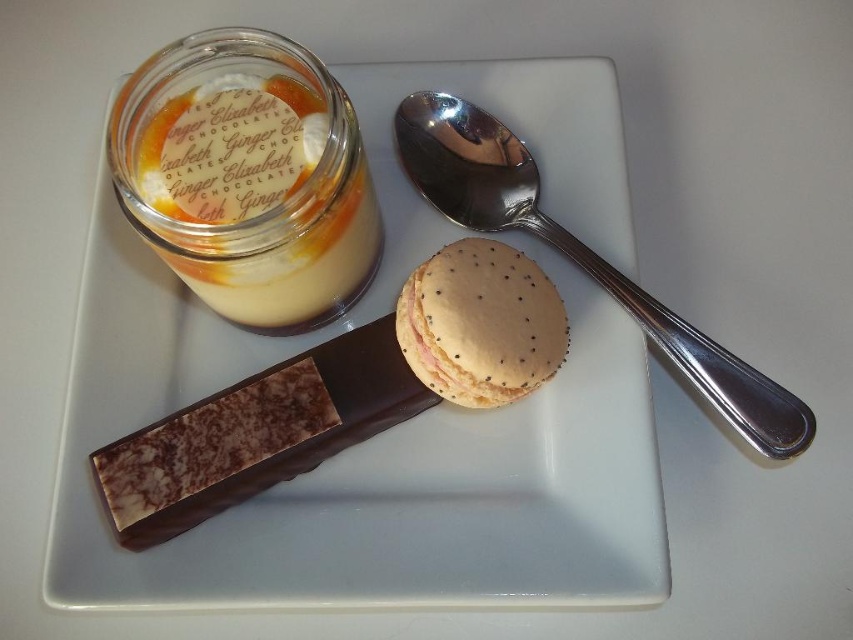
Consider the image. Between silver metallic spoon at upper right and golden textured macaron at center, which one is positioned lower?

golden textured macaron at center is below.

Does silver metallic spoon at upper right appear on the left side of golden textured macaron at center?

No, silver metallic spoon at upper right is not to the left of golden textured macaron at center.

Between point (675, 344) and point (422, 348), which one is positioned behind?

The point (675, 344) is behind.

You are a GUI agent. You are given a task and a screenshot of the screen. Output one action in this format:
    pyautogui.click(x=<x>, y=<y>)
    Task: Click on the silver metallic spoon at upper right
    This screenshot has width=853, height=640.
    Given the screenshot: What is the action you would take?
    pyautogui.click(x=579, y=257)

Can you confirm if translucent glass jar at upper left is shorter than golden textured macaron at center?

No, translucent glass jar at upper left is not shorter than golden textured macaron at center.

Between point (244, 113) and point (543, 376), which one is positioned behind?

The point (244, 113) is behind.

Does point (192, 179) come farther from viewer compared to point (495, 326)?

Yes, it is behind point (495, 326).

Locate an element on the screen. The image size is (853, 640). translucent glass jar at upper left is located at coordinates (247, 177).

Which is in front, point (595, 131) or point (564, 248)?

Point (564, 248) is more forward.

Does white ceramic plate at center appear under silver metallic spoon at upper right?

Yes.

You are a GUI agent. You are given a task and a screenshot of the screen. Output one action in this format:
    pyautogui.click(x=<x>, y=<y>)
    Task: Click on the white ceramic plate at center
    The width and height of the screenshot is (853, 640).
    Given the screenshot: What is the action you would take?
    coord(399,424)

Identify the location of white ceramic plate at center. The width and height of the screenshot is (853, 640). (399, 424).